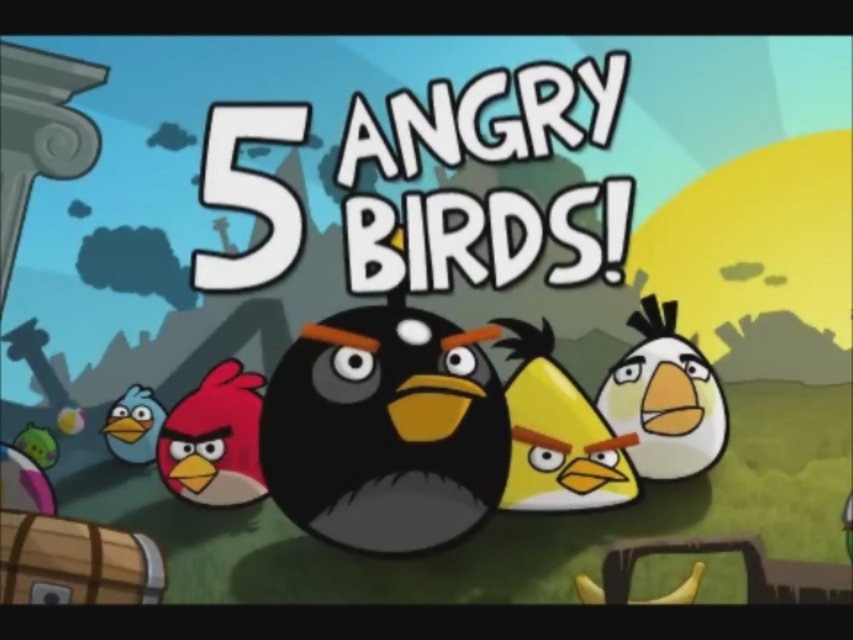
Question: In this image, where is black matte bird at center located relative to matte pink bird at left?

Choices:
 (A) left
 (B) right

Answer: (B)

Question: Which object appears farthest from the camera in this image?

Choices:
 (A) black matte bird at center
 (B) white matte bird at center right
 (C) matte pink bird at left

Answer: (C)

Question: Is black matte bird at center bigger than matte pink bird at left?

Choices:
 (A) no
 (B) yes

Answer: (B)

Question: Estimate the real-world distances between objects in this image. Which object is closer to the white matte bird at center right?

Choices:
 (A) matte pink bird at left
 (B) black matte bird at center

Answer: (B)

Question: Based on their relative distances, which object is nearer to the white matte bird at center right?

Choices:
 (A) black matte bird at center
 (B) matte pink bird at left

Answer: (A)

Question: Does black matte bird at center have a greater width compared to matte pink bird at left?

Choices:
 (A) no
 (B) yes

Answer: (B)